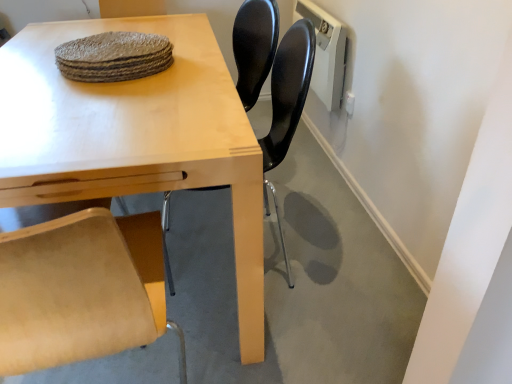
The image size is (512, 384). Identify the location of free space on the front side of rough woven placemat at upper center. (106, 107).